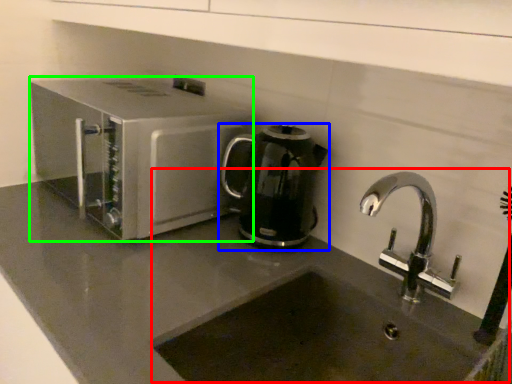
Question: Which object is the farthest from sink (highlighted by a red box)? Choose among these: kitchen appliance (highlighted by a blue box) or home appliance (highlighted by a green box).

Choices:
 (A) kitchen appliance
 (B) home appliance

Answer: (B)